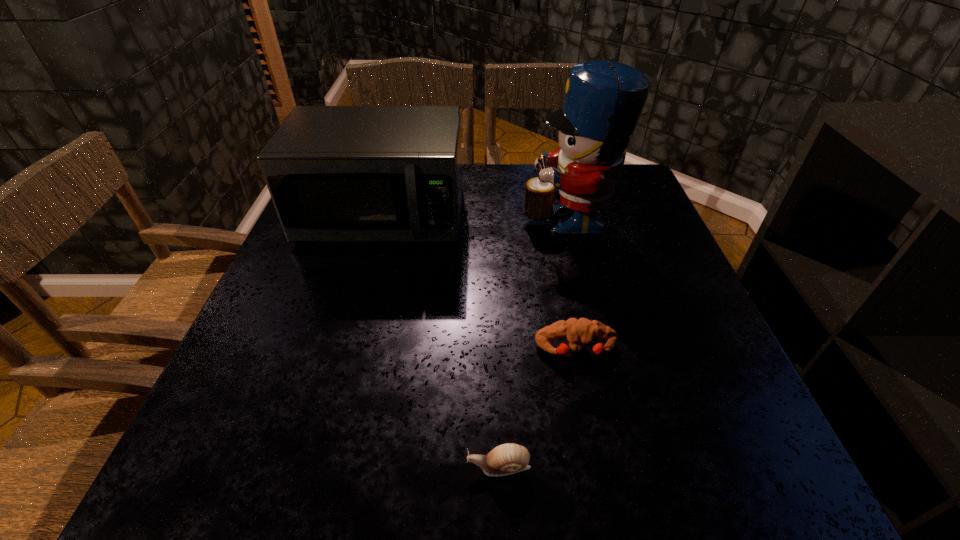
Find the location of a particular element. free region located with the gloves of the second nearest object facing forward is located at coordinates (592, 432).

You are a GUI agent. You are given a task and a screenshot of the screen. Output one action in this format:
    pyautogui.click(x=<x>, y=<y>)
    Task: Click on the vacant space located 0.210m on the front-facing side of the second object from left to right
    
    Given the screenshot: What is the action you would take?
    pyautogui.click(x=327, y=467)

Locate an element on the screen. blank space located on the front-facing side of the second object from left to right is located at coordinates (248, 467).

Where is `free location located 0.180m on the front-facing side of the second object from left to right`? free location located 0.180m on the front-facing side of the second object from left to right is located at coordinates (348, 467).

Image resolution: width=960 pixels, height=540 pixels. Find the location of `nutcracker situated at the far edge`. nutcracker situated at the far edge is located at coordinates (603, 101).

This screenshot has height=540, width=960. What are the coordinates of `microwave oven situated at the far edge` in the screenshot? It's located at (335, 173).

Where is `object at the near edge`? This screenshot has width=960, height=540. object at the near edge is located at coordinates (508, 458).

This screenshot has height=540, width=960. Identify the location of object that is at the left edge. 335,173.

At what (x,y) coordinates should I click in order to perform the action: click on object situated at the right edge. Please return your answer as a coordinate pair (x, y). This screenshot has height=540, width=960. Looking at the image, I should click on (603, 101).

You are a GUI agent. You are given a task and a screenshot of the screen. Output one action in this format:
    pyautogui.click(x=<x>, y=<y>)
    Task: Click on the object that is positioned at the far left corner
    The width and height of the screenshot is (960, 540).
    Given the screenshot: What is the action you would take?
    pyautogui.click(x=335, y=173)